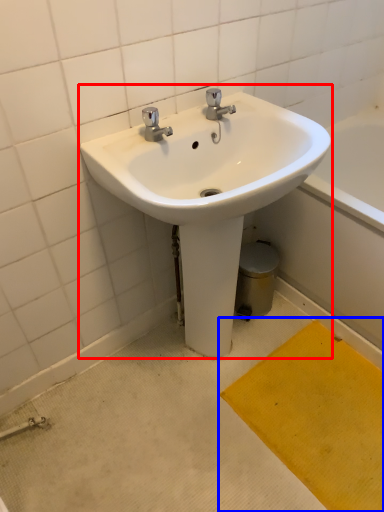
Question: Which of the following is the farthest to the observer, sink (highlighted by a red box) or doormat (highlighted by a blue box)?

Choices:
 (A) sink
 (B) doormat

Answer: (B)